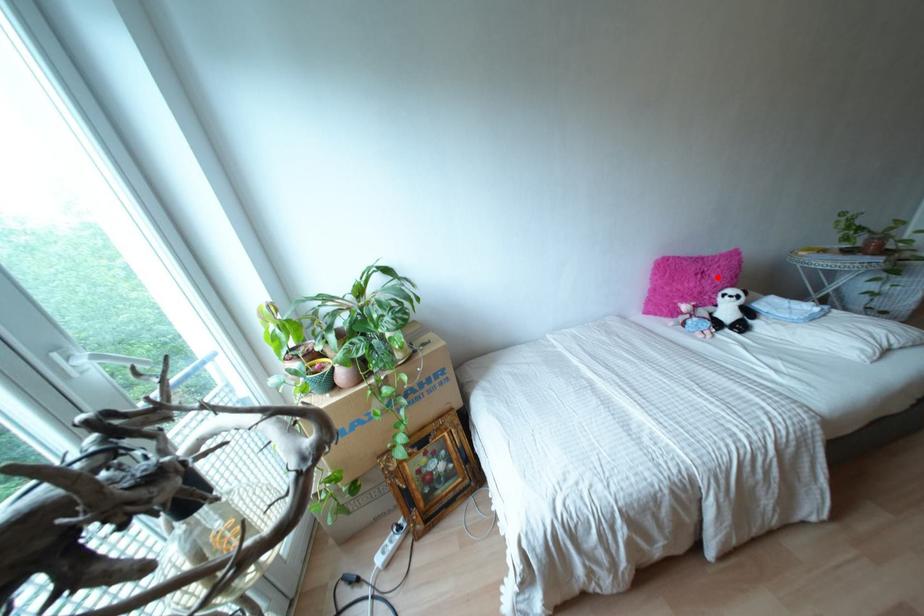
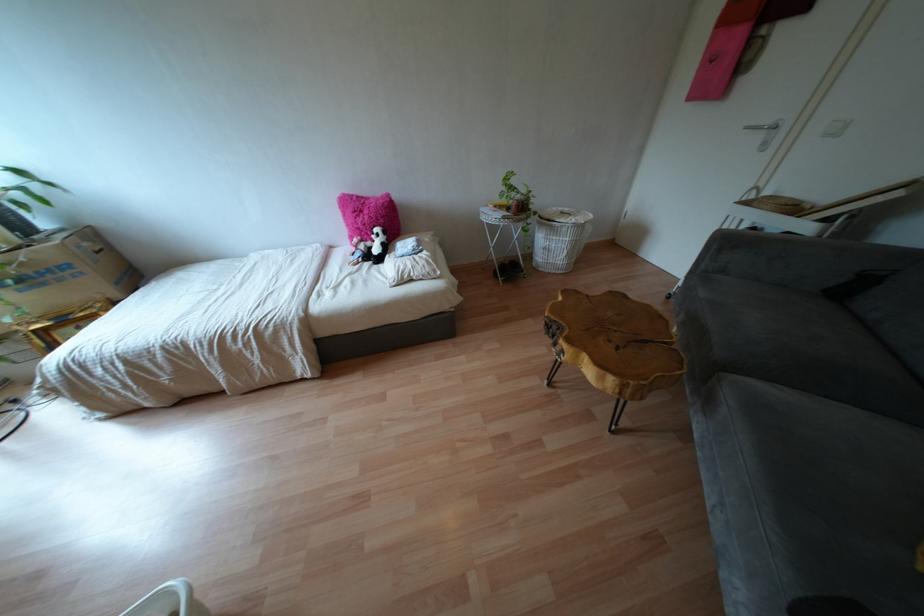
The point at the highlighted location is marked in the first image. Where is the corresponding point in the second image?

(365, 217)